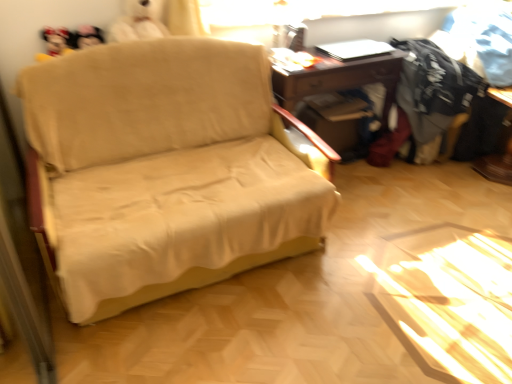
Question: Does black printed fabric at upper right, arranged as the 2th clothing when viewed from the left, have a lesser width compared to wooden desk at center?

Choices:
 (A) yes
 (B) no

Answer: (B)

Question: From a real-world perspective, is black printed fabric at upper right, arranged as the 2th clothing when viewed from the left, below wooden desk at center?

Choices:
 (A) no
 (B) yes

Answer: (A)

Question: From the image's perspective, is black printed fabric at upper right, arranged as the 2th clothing when viewed from the left, located above wooden desk at center?

Choices:
 (A) no
 (B) yes

Answer: (B)

Question: From a real-world perspective, is black printed fabric at upper right, which is the 1th clothing from right to left, positioned over wooden desk at center based on gravity?

Choices:
 (A) no
 (B) yes

Answer: (B)

Question: Is black printed fabric at upper right, arranged as the 2th clothing when viewed from the left, smaller than wooden desk at center?

Choices:
 (A) yes
 (B) no

Answer: (A)

Question: Can you confirm if black printed fabric at upper right, which is the 1th clothing from right to left, is shorter than wooden desk at center?

Choices:
 (A) no
 (B) yes

Answer: (B)

Question: Considering the relative positions of black printed fabric at upper right, arranged as the 2th clothing when viewed from the left, and beige fabric couch at center in the image provided, is black printed fabric at upper right, arranged as the 2th clothing when viewed from the left, in front of beige fabric couch at center?

Choices:
 (A) no
 (B) yes

Answer: (A)

Question: Can you confirm if black printed fabric at upper right, arranged as the 2th clothing when viewed from the left, is thinner than beige fabric couch at center?

Choices:
 (A) yes
 (B) no

Answer: (A)

Question: Could you tell me if black printed fabric at upper right, arranged as the 2th clothing when viewed from the left, is turned towards beige fabric couch at center?

Choices:
 (A) yes
 (B) no

Answer: (A)

Question: Is black printed fabric at upper right, arranged as the 2th clothing when viewed from the left, not inside beige fabric couch at center?

Choices:
 (A) no
 (B) yes

Answer: (B)

Question: Is black printed fabric at upper right, which is the 1th clothing from right to left, smaller than beige fabric couch at center?

Choices:
 (A) yes
 (B) no

Answer: (A)

Question: Considering the relative sizes of black printed fabric at upper right, which is the 1th clothing from right to left, and beige fabric couch at center in the image provided, is black printed fabric at upper right, which is the 1th clothing from right to left, wider than beige fabric couch at center?

Choices:
 (A) yes
 (B) no

Answer: (B)

Question: Is beige fabric couch at center facing towards dark gray cotton shirt at right, arranged as the 1th clothing when viewed from the left?

Choices:
 (A) yes
 (B) no

Answer: (B)